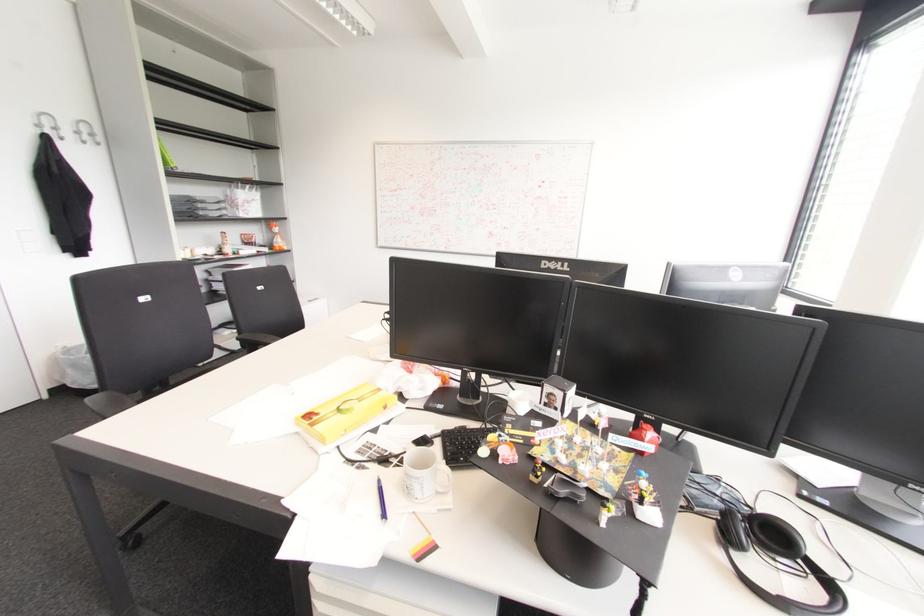
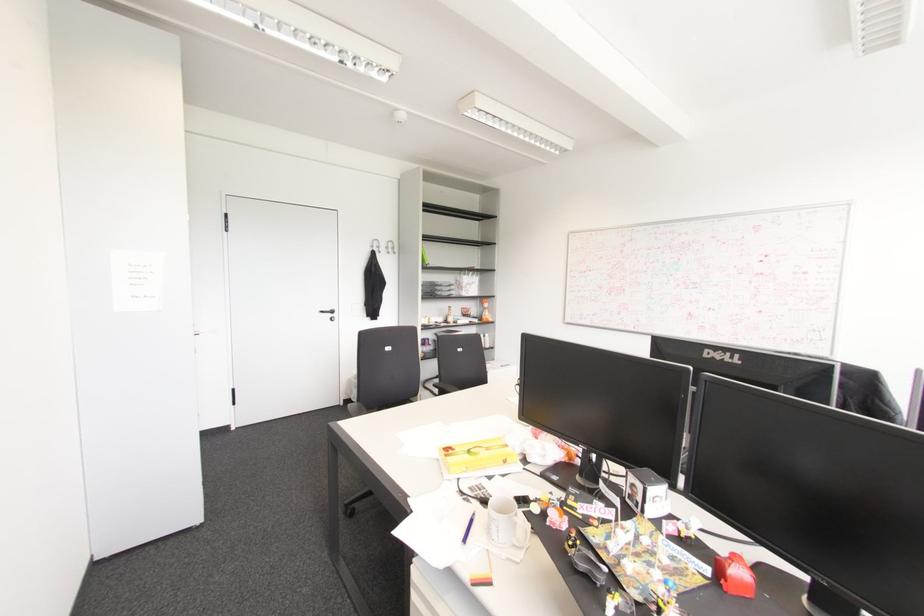
In the second image, find the point that corresponds to (91,135) in the first image.

(392, 248)